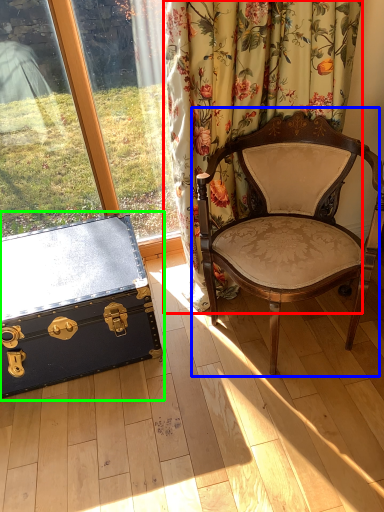
Question: Which object is the closest to the curtain (highlighted by a red box)? Choose among these: chair (highlighted by a blue box) or box (highlighted by a green box).

Choices:
 (A) chair
 (B) box

Answer: (A)